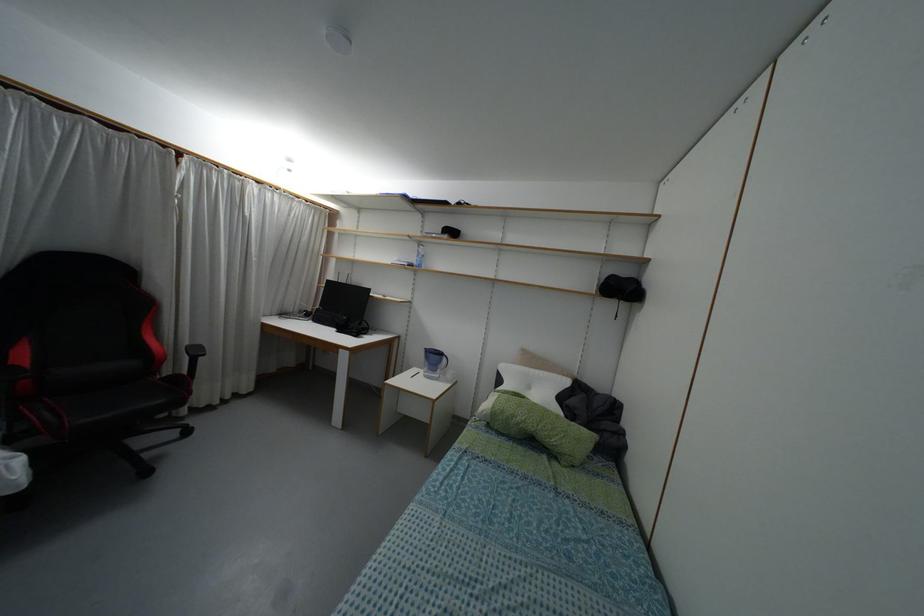
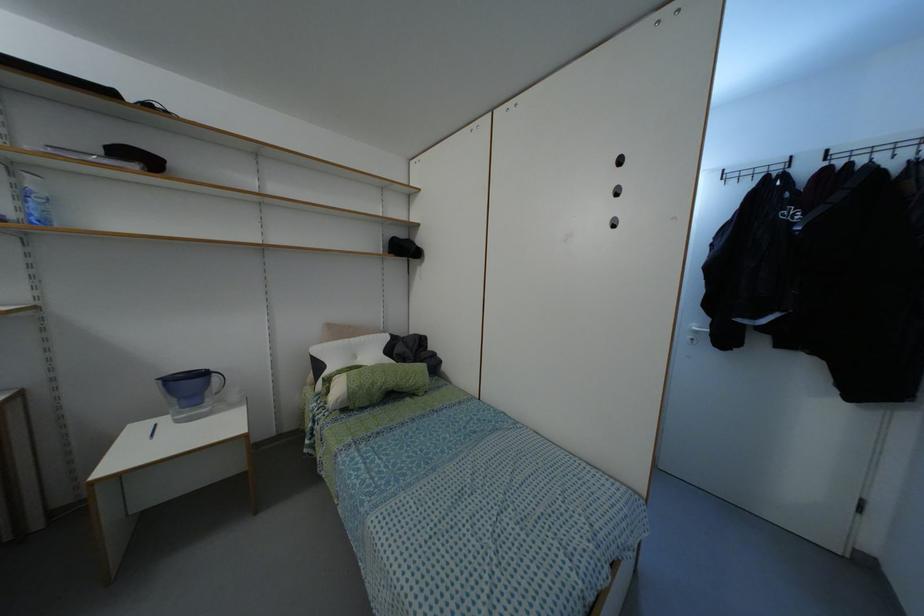
Find the pixel in the second image that matches point (526, 369) in the first image.

(345, 339)